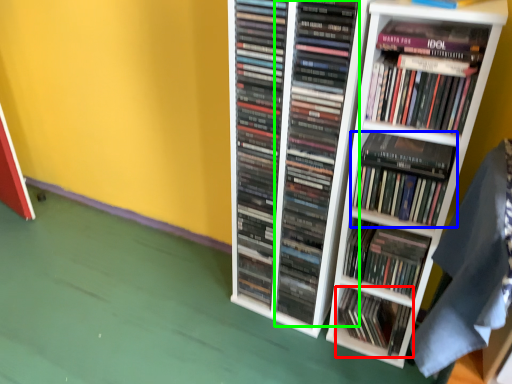
Question: Which object is the farthest from book (highlighted by a red box)? Choose among these: book (highlighted by a blue box) or book (highlighted by a green box).

Choices:
 (A) book
 (B) book

Answer: (A)